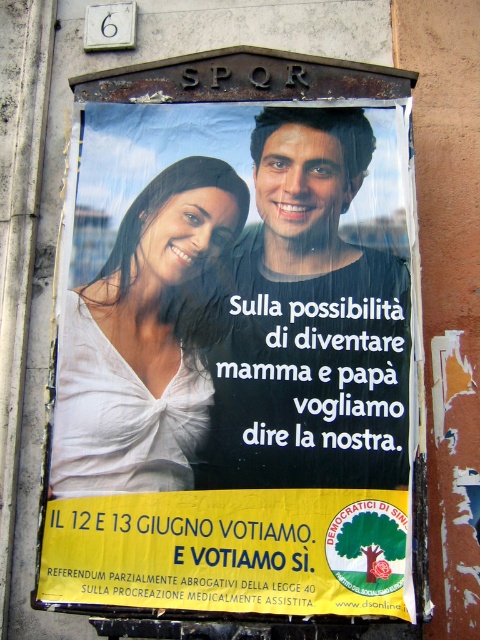
Between point (309, 289) and point (218, 300), which one is positioned in front?

Point (309, 289) is in front.

Can you confirm if white fabric poster at center is thinner than white satin blouse at upper left?

No.

Who is more distant from viewer, (x=227, y=600) or (x=108, y=356)?

Point (x=108, y=356)

I want to click on white fabric poster at center, so point(232,364).

Is white fabric poster at center in front of matte black shirt at center?

Yes, it is in front of matte black shirt at center.

What do you see at coordinates (232, 364) in the screenshot? I see `white fabric poster at center` at bounding box center [232, 364].

Where is `white fabric poster at center`? The image size is (480, 640). white fabric poster at center is located at coordinates (232, 364).

Can you confirm if matte black shirt at center is smaller than white satin blouse at upper left?

No.

You are a GUI agent. You are given a task and a screenshot of the screen. Output one action in this format:
    pyautogui.click(x=<x>, y=<y>)
    Task: Click on the matte black shirt at center
    Image resolution: width=480 pixels, height=640 pixels.
    Given the screenshot: What is the action you would take?
    pyautogui.click(x=310, y=323)

Where is `matte black shirt at center`? matte black shirt at center is located at coordinates pos(310,323).